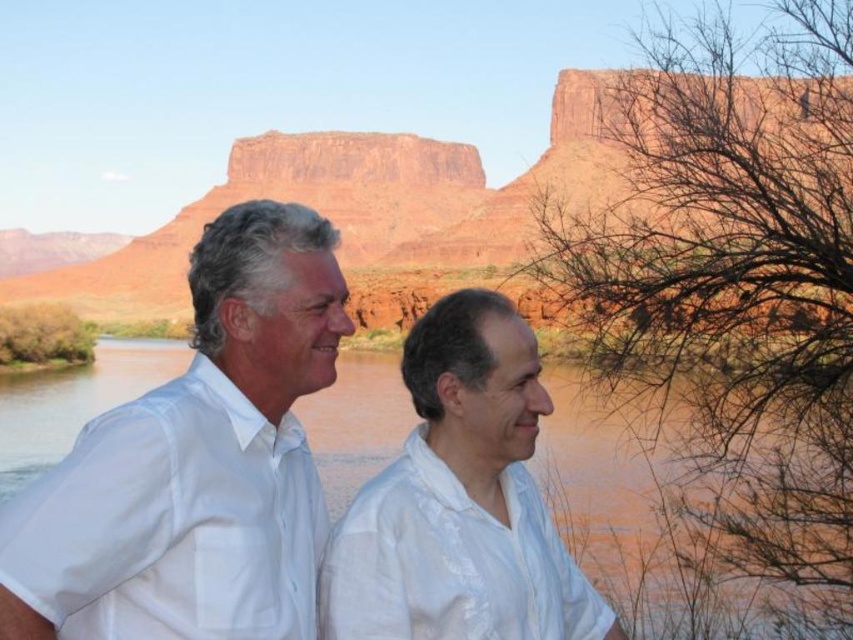
Question: Which object is closer to the camera taking this photo?

Choices:
 (A) white cotton shirt at center
 (B) white cotton shirt at left
 (C) brown sedimentary water at center

Answer: (B)

Question: Which of the following is the closest to the observer?

Choices:
 (A) white cotton shirt at center
 (B) brown sedimentary water at center

Answer: (A)

Question: Is white cotton shirt at left below white cotton shirt at center?

Choices:
 (A) yes
 (B) no

Answer: (B)

Question: Is brown sedimentary water at center closer to camera compared to white cotton shirt at center?

Choices:
 (A) no
 (B) yes

Answer: (A)

Question: Can you confirm if white cotton shirt at left is positioned to the right of white cotton shirt at center?

Choices:
 (A) no
 (B) yes

Answer: (A)

Question: Which object is the closest to the brown sedimentary water at center?

Choices:
 (A) white cotton shirt at center
 (B) white cotton shirt at left

Answer: (A)